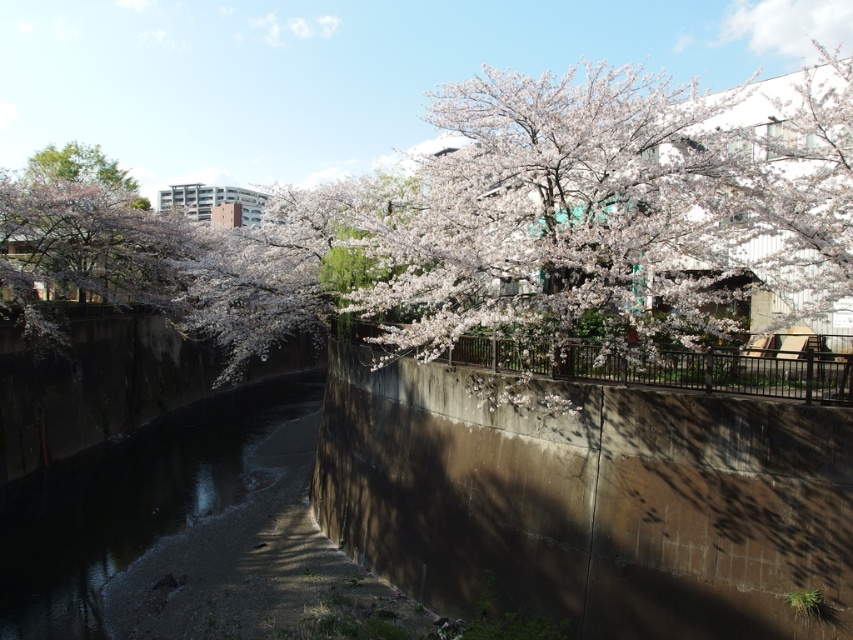
You are a photographer aiming to capture the white blossoms at upper center and the pink blossoms at left in a single shot. Which blossoms are located above the other?

The pink blossoms at left are above the white blossoms at upper center because the white blossoms at upper center is positioned under the pink blossoms at left.

You are a photographer standing in the middle of the canal. You want to take a photo that includes both the dark concrete river at center and the pink blossoms at left. Which object should you focus on first to ensure both are in clear view?

Since the dark concrete river at center is closer to the viewer than the pink blossoms at left, you should focus on the dark concrete river at center first to ensure both are in clear view.

You are standing at the edge of the canal in the urban scene. You notice two points marked in the image. Which point, point (15, 484) or point (86, 161), is closer to you?

Point (15, 484) is closer to the viewer than point (86, 161).